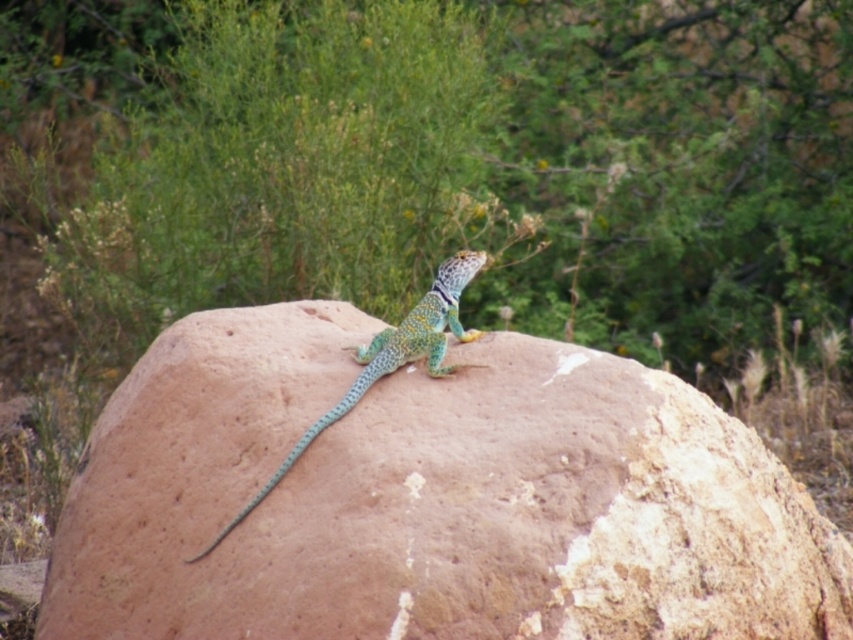
This screenshot has width=853, height=640. Describe the element at coordinates (392, 356) in the screenshot. I see `shiny green scales lizard at center` at that location.

Is shiny green scales lizard at center below green scaly tail at center?

Actually, shiny green scales lizard at center is above green scaly tail at center.

Find the location of a particular element. The height and width of the screenshot is (640, 853). shiny green scales lizard at center is located at coordinates (392, 356).

Which of these two, smooth brown rock at center or green scaly tail at center, stands taller?

smooth brown rock at center

Describe the element at coordinates (428, 499) in the screenshot. I see `smooth brown rock at center` at that location.

Image resolution: width=853 pixels, height=640 pixels. I want to click on smooth brown rock at center, so click(x=428, y=499).

This screenshot has width=853, height=640. Describe the element at coordinates (428, 499) in the screenshot. I see `smooth brown rock at center` at that location.

Does smooth brown rock at center have a greater height compared to shiny green scales lizard at center?

Correct, smooth brown rock at center is much taller as shiny green scales lizard at center.

Is point (569, 472) positioned behind point (422, 310)?

No, it is in front of (422, 310).

The height and width of the screenshot is (640, 853). I want to click on smooth brown rock at center, so click(428, 499).